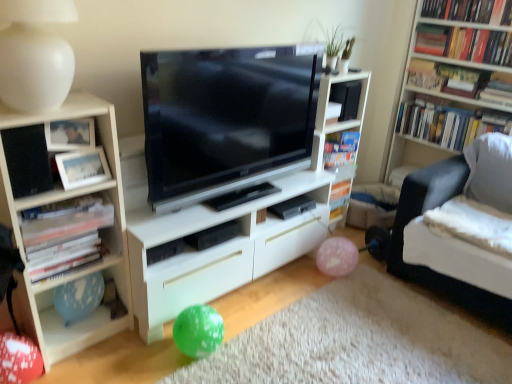
Question: Considering the relative sizes of black glossy tv at center and matte white picture frame at upper left, positioned as the second picture frame in top-to-bottom order, in the image provided, is black glossy tv at center thinner than matte white picture frame at upper left, positioned as the second picture frame in top-to-bottom order,?

Choices:
 (A) no
 (B) yes

Answer: (A)

Question: From the image's perspective, is black glossy tv at center over matte white picture frame at upper left, positioned as the second picture frame in top-to-bottom order?

Choices:
 (A) yes
 (B) no

Answer: (A)

Question: Does black glossy tv at center lie in front of matte white picture frame at upper left, which is the first picture frame from bottom to top?

Choices:
 (A) yes
 (B) no

Answer: (A)

Question: Is black glossy tv at center oriented away from matte white picture frame at upper left, positioned as the second picture frame in top-to-bottom order?

Choices:
 (A) no
 (B) yes

Answer: (A)

Question: Considering the relative sizes of black glossy tv at center and matte white picture frame at upper left, which is the first picture frame from bottom to top, in the image provided, is black glossy tv at center smaller than matte white picture frame at upper left, which is the first picture frame from bottom to top,?

Choices:
 (A) no
 (B) yes

Answer: (A)

Question: Is black glossy tv at center not close to matte white picture frame at upper left, positioned as the second picture frame in top-to-bottom order?

Choices:
 (A) yes
 (B) no

Answer: (B)

Question: Is hardcover book at upper right, which appears as the 2th book when ordered from the bottom, aimed at black glossy tv at center?

Choices:
 (A) no
 (B) yes

Answer: (A)

Question: From a real-world perspective, does hardcover book at upper right, the 2th book from the left, sit lower than black glossy tv at center?

Choices:
 (A) yes
 (B) no

Answer: (A)

Question: Is hardcover book at upper right, which appears as the 2th book when ordered from the bottom, wider than black glossy tv at center?

Choices:
 (A) yes
 (B) no

Answer: (A)

Question: From the image's perspective, would you say hardcover book at upper right, which is the 4th book in right-to-left order, is positioned over black glossy tv at center?

Choices:
 (A) no
 (B) yes

Answer: (B)

Question: Is hardcover book at upper right, which is the 4th book in right-to-left order, taller than black glossy tv at center?

Choices:
 (A) no
 (B) yes

Answer: (A)

Question: From a real-world perspective, is hardcover book at upper right, which ranks as the fourth book in top-to-bottom order, located higher than black glossy tv at center?

Choices:
 (A) yes
 (B) no

Answer: (B)

Question: Is light wood bookcase at left positioned before white matte lamp at upper left?

Choices:
 (A) yes
 (B) no

Answer: (B)